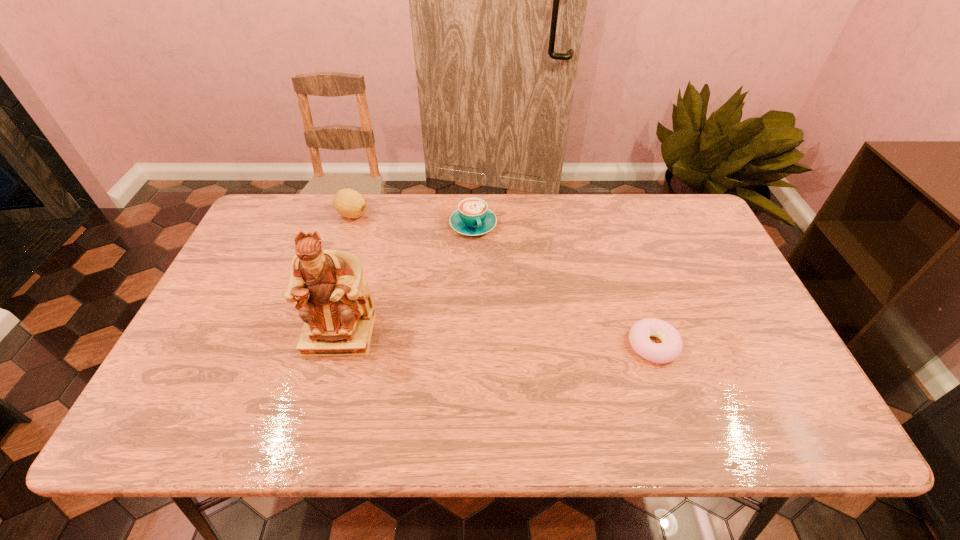
I want to click on vacant space at the right edge of the desktop, so click(703, 296).

This screenshot has width=960, height=540. In order to click on vacant point located between the figurine and the second shortest object in this screenshot , I will do `click(406, 279)`.

Locate an element on the screen. This screenshot has height=540, width=960. free space between the figurine and the doughnut is located at coordinates (496, 340).

This screenshot has width=960, height=540. Find the location of `free spot between the third object from left to right and the second tallest object`. free spot between the third object from left to right and the second tallest object is located at coordinates (413, 220).

Locate an element on the screen. This screenshot has width=960, height=540. blank region between the tallest object and the rightmost object is located at coordinates (496, 340).

Find the location of a particular element. This screenshot has width=960, height=540. vacant area that lies between the second tallest object and the shortest object is located at coordinates (503, 280).

Where is `blank region between the cappuccino and the tallest object`? The height and width of the screenshot is (540, 960). blank region between the cappuccino and the tallest object is located at coordinates (406, 279).

The width and height of the screenshot is (960, 540). Identify the location of vacant region between the shortest object and the lemon. (503, 280).

This screenshot has width=960, height=540. In order to click on vacant region between the tallest object and the third object from left to right in this screenshot , I will do `click(406, 279)`.

The height and width of the screenshot is (540, 960). Find the location of `vacant point located between the lemon and the doughnut`. vacant point located between the lemon and the doughnut is located at coordinates (503, 280).